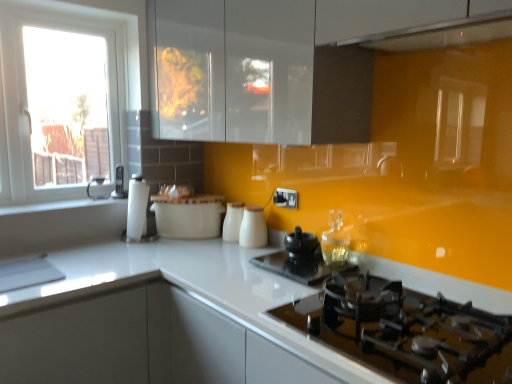
Find the location of `vacant region to the left of white glossy milk jugs at center, which is the 3th kitchen appliance in left-to-right order`. vacant region to the left of white glossy milk jugs at center, which is the 3th kitchen appliance in left-to-right order is located at coordinates (221, 243).